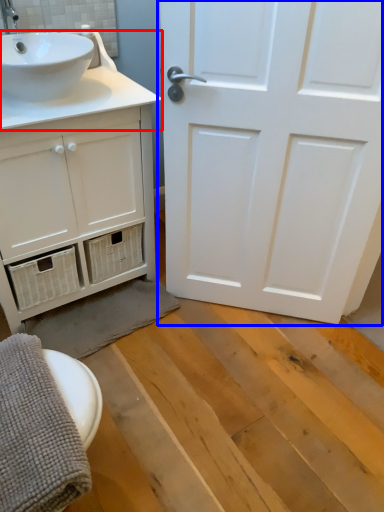
Question: Which of the following is the closest to the observer, counter top (highlighted by a red box) or door (highlighted by a blue box)?

Choices:
 (A) counter top
 (B) door

Answer: (B)